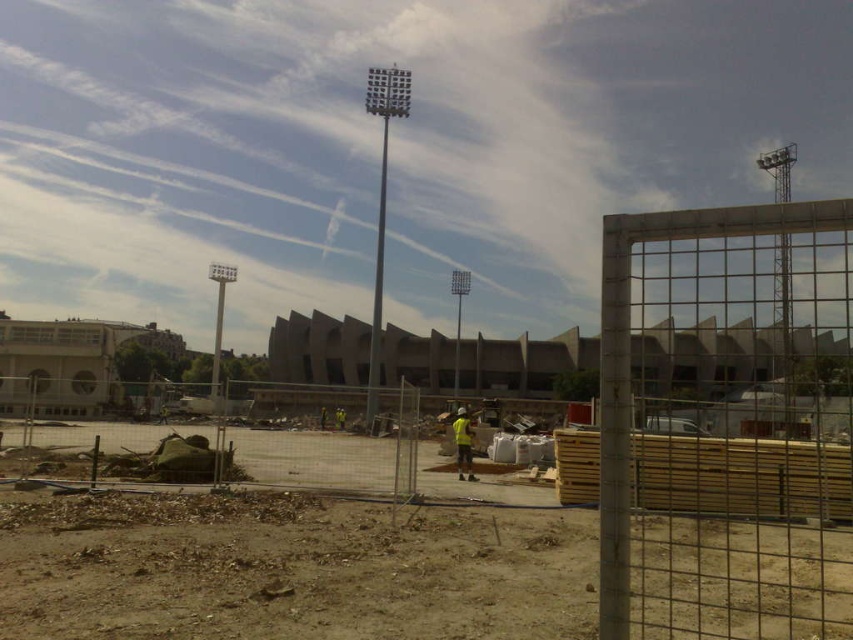
Question: Is metal mesh fence at center behind yellow reflective vest at center?

Choices:
 (A) no
 (B) yes

Answer: (A)

Question: Among these points, which one is farthest from the camera?

Choices:
 (A) (473, 470)
 (B) (788, 460)

Answer: (A)

Question: Does metal mesh fence at center have a larger size compared to yellow reflective vest at center?

Choices:
 (A) yes
 (B) no

Answer: (A)

Question: Which of the following is the closest to the observer?

Choices:
 (A) yellow reflective vest at center
 (B) metal mesh fence at center

Answer: (B)

Question: Is metal mesh fence at center bigger than yellow reflective vest at center?

Choices:
 (A) no
 (B) yes

Answer: (B)